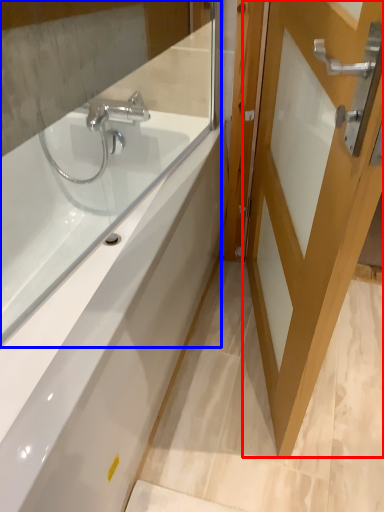
Question: Which object appears closest to the camera in this image, door (highlighted by a red box) or mirror (highlighted by a blue box)?

Choices:
 (A) door
 (B) mirror

Answer: (B)